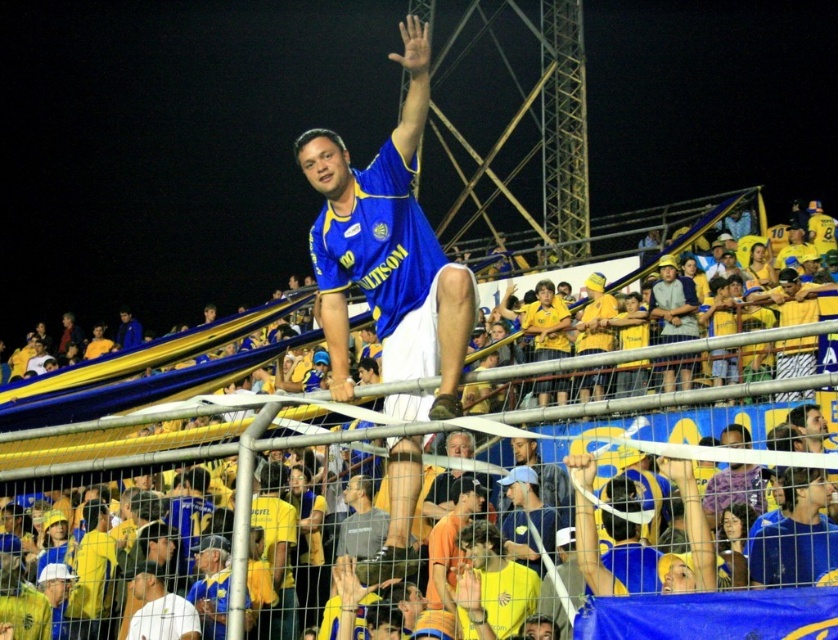
You are a photographer at the soccer match. You want to take a photo of the blue jersey at center. Where should you aim your camera?

You should aim your camera at point (388, 253) to capture the blue jersey at center.

You are a photographer at the soccer match. You want to take a photo of the blue jersey at center and the yellow jersey at upper center. Which one will appear taller in the photo?

The blue jersey at center will appear taller in the photo because it has a greater height compared to the yellow jersey at upper center.